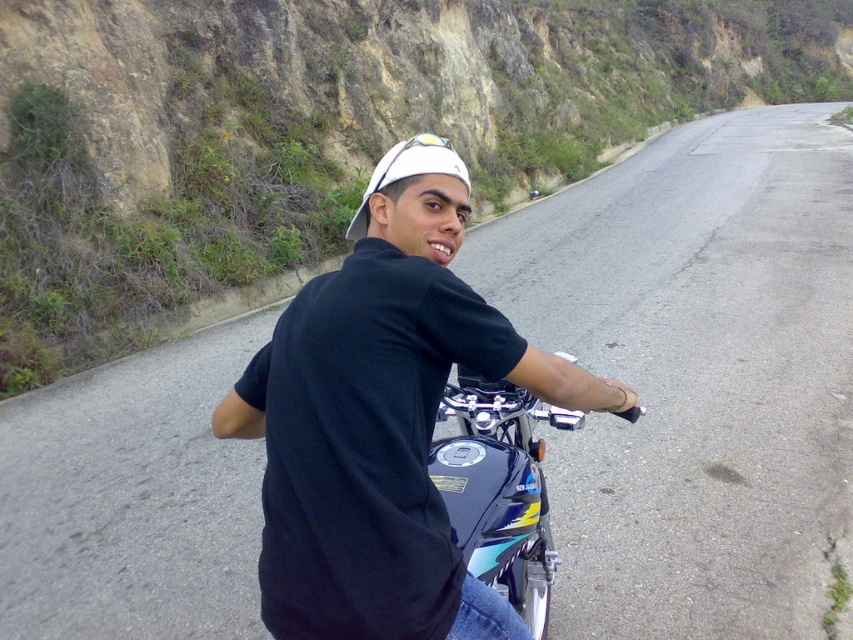
Question: Which point is closer to the camera?

Choices:
 (A) (515, 516)
 (B) (386, 177)
 (C) (386, 605)

Answer: (C)

Question: Considering the real-world distances, which object is closest to the white matte baseball cap at center?

Choices:
 (A) black matte shirt at center
 (B) glossy metallic motorcycle at center

Answer: (B)

Question: Which object appears farthest from the camera in this image?

Choices:
 (A) black matte shirt at center
 (B) glossy metallic motorcycle at center

Answer: (B)

Question: Does glossy metallic motorcycle at center have a greater width compared to white matte baseball cap at center?

Choices:
 (A) yes
 (B) no

Answer: (B)

Question: Where is black matte shirt at center located in relation to white matte baseball cap at center in the image?

Choices:
 (A) below
 (B) above

Answer: (A)

Question: Does glossy metallic motorcycle at center have a larger size compared to white matte baseball cap at center?

Choices:
 (A) no
 (B) yes

Answer: (A)